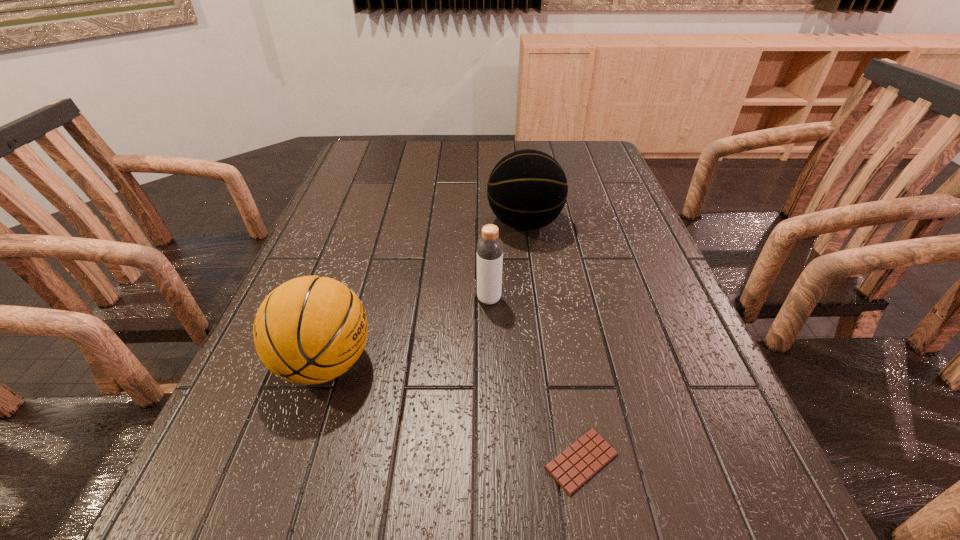
The width and height of the screenshot is (960, 540). I want to click on free space between the candy bar and the right basketball, so click(553, 342).

Find the location of a particular element. The image size is (960, 540). blank region between the farthest object and the bottle is located at coordinates (507, 261).

Identify the location of empty space between the bottle and the farthest object. This screenshot has width=960, height=540. (507, 261).

The width and height of the screenshot is (960, 540). I want to click on empty location between the bottle and the second nearest object, so click(x=407, y=331).

Locate an element on the screen. vacant region between the right basketball and the third nearest object is located at coordinates (507, 261).

The width and height of the screenshot is (960, 540). Identify the location of object that can be found as the second closest to the right basketball. (309, 330).

You are a GUI agent. You are given a task and a screenshot of the screen. Output one action in this format:
    pyautogui.click(x=<x>, y=<y>)
    Task: Click on the second closest object to the second farthest object
    
    Given the screenshot: What is the action you would take?
    pyautogui.click(x=309, y=330)

This screenshot has height=540, width=960. I want to click on vacant space that satisfies the following two spatial constraints: 1. on the front side of the bottle; 2. on the surface of the left basketball near the brand logo, so click(491, 363).

I want to click on free space that satisfies the following two spatial constraints: 1. on the front side of the farther basketball; 2. on the right side of the nearest object, so click(557, 461).

I want to click on free region that satisfies the following two spatial constraints: 1. on the front side of the farthest object; 2. on the left side of the shortest object, so click(x=557, y=461).